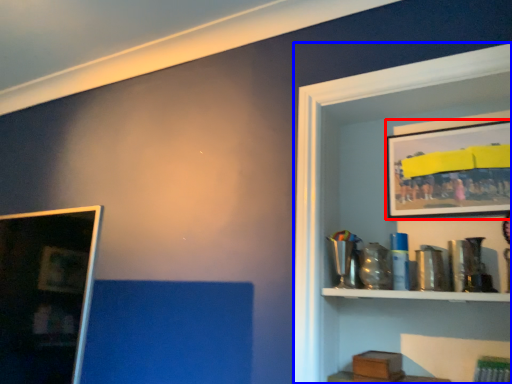
Question: Which object is closer to the camera taking this photo, picture frame (highlighted by a red box) or shelf (highlighted by a blue box)?

Choices:
 (A) picture frame
 (B) shelf

Answer: (B)